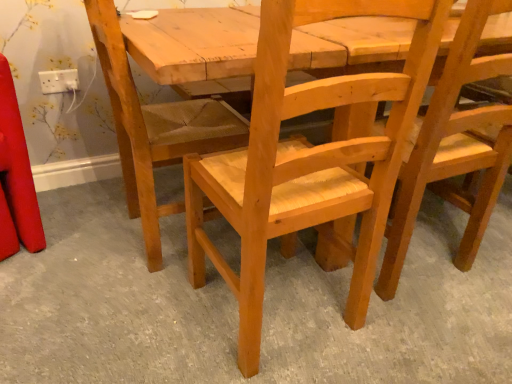
The image size is (512, 384). In order to click on free space above natural wood chair at center (from a real-world perspective) in this screenshot , I will do `click(269, 280)`.